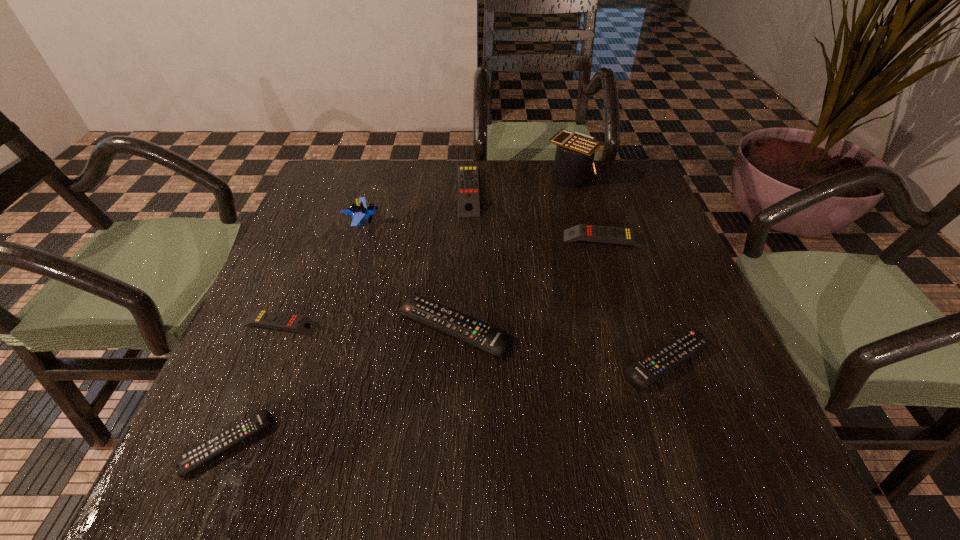
Locate an element on the screen. Image resolution: width=960 pixels, height=540 pixels. vacant area situated 0.090m on the back of the nearest black remote control is located at coordinates (259, 367).

At what (x,y) coordinates should I click in order to perform the action: click on calculator located in the far edge section of the desktop. Please return your answer as a coordinate pair (x, y). Looking at the image, I should click on (574, 158).

Where is `Lego that is positioned at the far edge`? Lego that is positioned at the far edge is located at coordinates (359, 211).

Where is `remote control that is at the far edge`? Image resolution: width=960 pixels, height=540 pixels. remote control that is at the far edge is located at coordinates click(468, 184).

What are the coordinates of `object that is at the near edge` in the screenshot? It's located at (x=193, y=458).

The width and height of the screenshot is (960, 540). I want to click on Lego located at the left edge, so click(x=359, y=211).

Where is `calculator that is at the right edge`? The width and height of the screenshot is (960, 540). calculator that is at the right edge is located at coordinates (574, 158).

At what (x,y) coordinates should I click in order to perform the action: click on object located in the far left corner section of the desktop. Please return your answer as a coordinate pair (x, y). Looking at the image, I should click on (359, 211).

This screenshot has width=960, height=540. What are the coordinates of `object at the near left corner` in the screenshot? It's located at (193, 458).

Locate an element on the screen. Image resolution: width=960 pixels, height=540 pixels. object present at the far right corner is located at coordinates (574, 158).